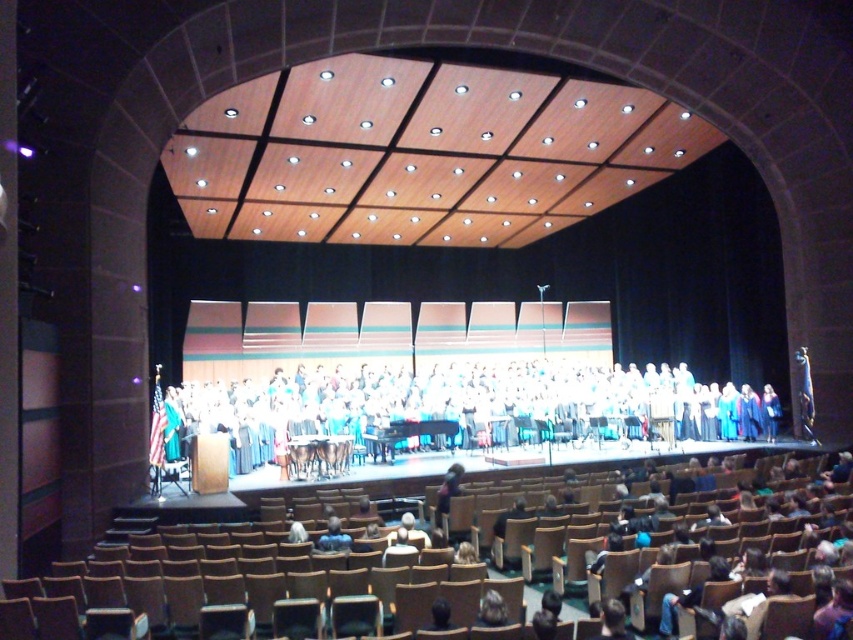
Question: Is dark brown leather jacket at center below light brown leather jacket at lower center?

Choices:
 (A) no
 (B) yes

Answer: (B)

Question: Which point appears closest to the camera in this image?

Choices:
 (A) (294, 419)
 (B) (457, 493)

Answer: (B)

Question: Is light brown wooden chair at center to the right of black hair at center from the viewer's perspective?

Choices:
 (A) yes
 (B) no

Answer: (B)

Question: In this image, where is light brown leather jacket at lower center located relative to black hair at center?

Choices:
 (A) left
 (B) right

Answer: (B)

Question: Based on their relative distances, which object is nearer to the light brown leather jacket at lower center?

Choices:
 (A) light brown wooden chair at center
 (B) dark brown leather jacket at center
 (C) black hair at center
 (D) white fabric choir at center

Answer: (C)

Question: Which point is farther from the camera taking this photo?

Choices:
 (A) (434, 612)
 (B) (728, 429)
 (C) (413, 552)

Answer: (B)